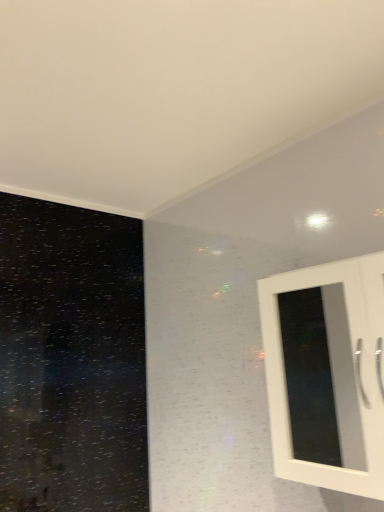
Describe the element at coordinates (327, 374) in the screenshot. I see `white glossy cabinet at right` at that location.

Where is `white glossy cabinet at right`? white glossy cabinet at right is located at coordinates (327, 374).

You are a GUI agent. You are given a task and a screenshot of the screen. Output one action in this format:
    pyautogui.click(x=<x>, y=<y>)
    Task: Click on the white glossy cabinet at right
    Image resolution: width=384 pixels, height=512 pixels.
    Given the screenshot: What is the action you would take?
    pyautogui.click(x=327, y=374)